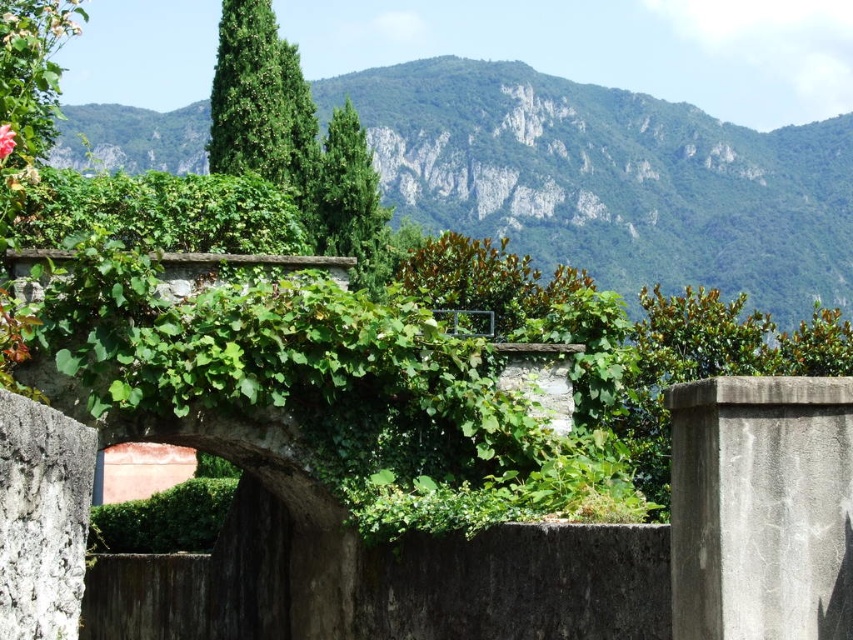
Question: Is green leafy mountain at center wider than green leafy plant at center?

Choices:
 (A) yes
 (B) no

Answer: (A)

Question: Where is green leafy mountain at center located in relation to green leafy plant at center in the image?

Choices:
 (A) below
 (B) above

Answer: (B)

Question: Which point is farther to the camera?

Choices:
 (A) green leafy mountain at center
 (B) green leafy plant at center

Answer: (A)

Question: Can you confirm if green leafy mountain at center is bigger than green leafy plant at center?

Choices:
 (A) yes
 (B) no

Answer: (A)